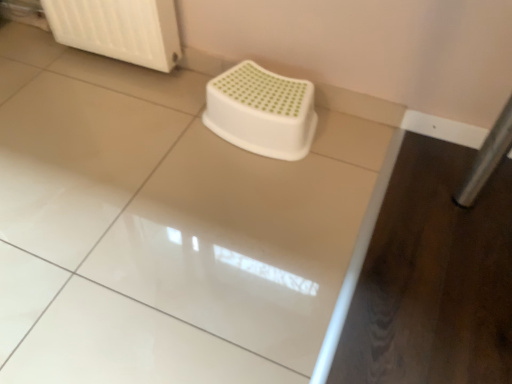
This screenshot has width=512, height=384. In order to click on spots to the right of white plastic stool at center in this screenshot , I will do `click(356, 150)`.